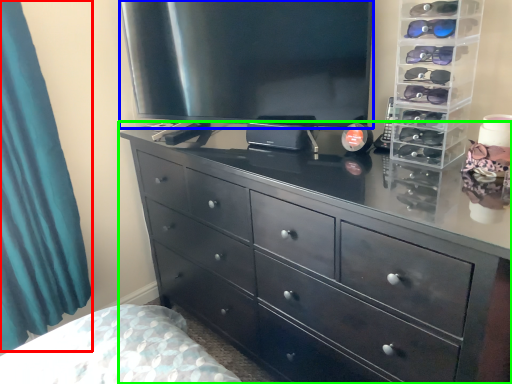
Question: Which object is positioned closest to curtain (highlighted by a red box)? Select from television (highlighted by a blue box) and chest of drawers (highlighted by a green box).

Choices:
 (A) television
 (B) chest of drawers

Answer: (A)